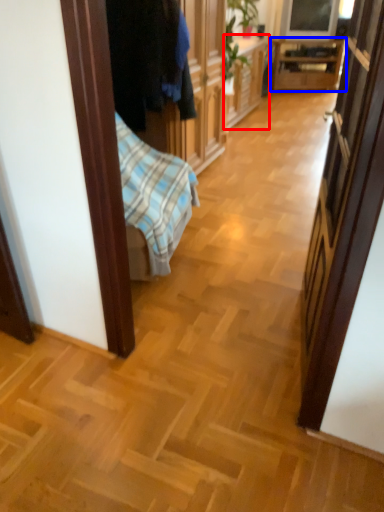
Question: Which of the following is the farthest to the observer, cabinetry (highlighted by a red box) or table (highlighted by a blue box)?

Choices:
 (A) cabinetry
 (B) table

Answer: (B)